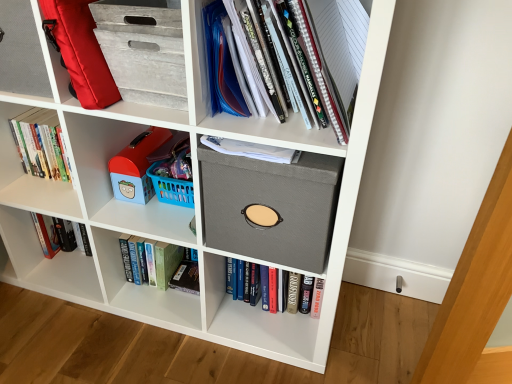
Question: Would you say gray fabric storage box at center contains hardcover book at left, which is counted as the 3th book, starting from the bottom?

Choices:
 (A) no
 (B) yes

Answer: (A)

Question: From the image's perspective, is gray fabric storage box at center below hardcover book at left, positioned as the first book in top-to-bottom order?

Choices:
 (A) no
 (B) yes

Answer: (B)

Question: Is gray fabric storage box at center positioned with its back to hardcover book at left, the first book viewed from the left?

Choices:
 (A) yes
 (B) no

Answer: (B)

Question: From a real-world perspective, is gray fabric storage box at center on top of hardcover book at left, which is counted as the 3th book, starting from the bottom?

Choices:
 (A) yes
 (B) no

Answer: (A)

Question: Does gray fabric storage box at center appear on the left side of hardcover book at left, which is counted as the 3th book, starting from the bottom?

Choices:
 (A) no
 (B) yes

Answer: (A)

Question: From the image's perspective, is red fabric backpack at upper left located above or below hardcover book at left, positioned as the 3th book in right-to-left order?

Choices:
 (A) below
 (B) above

Answer: (B)

Question: Is red fabric backpack at upper left inside or outside of hardcover book at left, positioned as the 3th book in right-to-left order?

Choices:
 (A) outside
 (B) inside

Answer: (A)

Question: Relative to hardcover book at left, positioned as the 3th book in right-to-left order, is red fabric backpack at upper left in front or behind?

Choices:
 (A) behind
 (B) front

Answer: (B)

Question: Is red fabric backpack at upper left to the left or to the right of hardcover book at left, the first book viewed from the left, in the image?

Choices:
 (A) left
 (B) right

Answer: (B)

Question: Considering the positions of hardcover book at center, marked as the first book in a right-to-left arrangement, and red fabric backpack at upper left in the image, is hardcover book at center, marked as the first book in a right-to-left arrangement, bigger or smaller than red fabric backpack at upper left?

Choices:
 (A) big
 (B) small

Answer: (B)

Question: Is point (251, 288) positioned closer to the camera than point (81, 97)?

Choices:
 (A) closer
 (B) farther

Answer: (B)

Question: From the image's perspective, is hardcover book at center, placed as the 3th book when sorted from left to right, located above or below red fabric backpack at upper left?

Choices:
 (A) above
 (B) below

Answer: (B)

Question: Relative to red fabric backpack at upper left, is hardcover book at center, placed as the 3th book when sorted from left to right, in front or behind?

Choices:
 (A) front
 (B) behind

Answer: (B)

Question: Is matte plastic toy at left, which ranks as the second shelf in right-to-left order, bigger or smaller than hardcover book at center, placed as the 1th book when sorted from bottom to top?

Choices:
 (A) small
 (B) big

Answer: (B)

Question: In the image, is matte plastic toy at left, which is the 1th shelf in back-to-front order, on the left side or the right side of hardcover book at center, placed as the 3th book when sorted from left to right?

Choices:
 (A) left
 (B) right

Answer: (A)